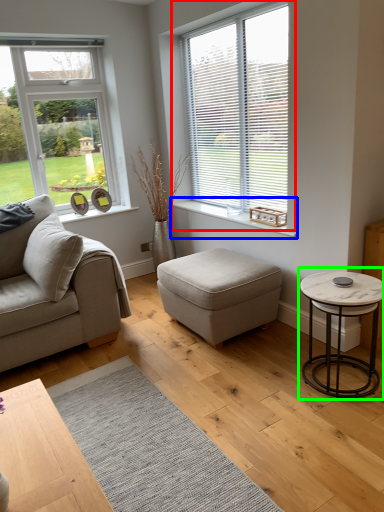
Question: Which object is the closest to the window (highlighted by a red box)? Choose among these: window sill (highlighted by a blue box) or coffee table (highlighted by a green box).

Choices:
 (A) window sill
 (B) coffee table

Answer: (A)